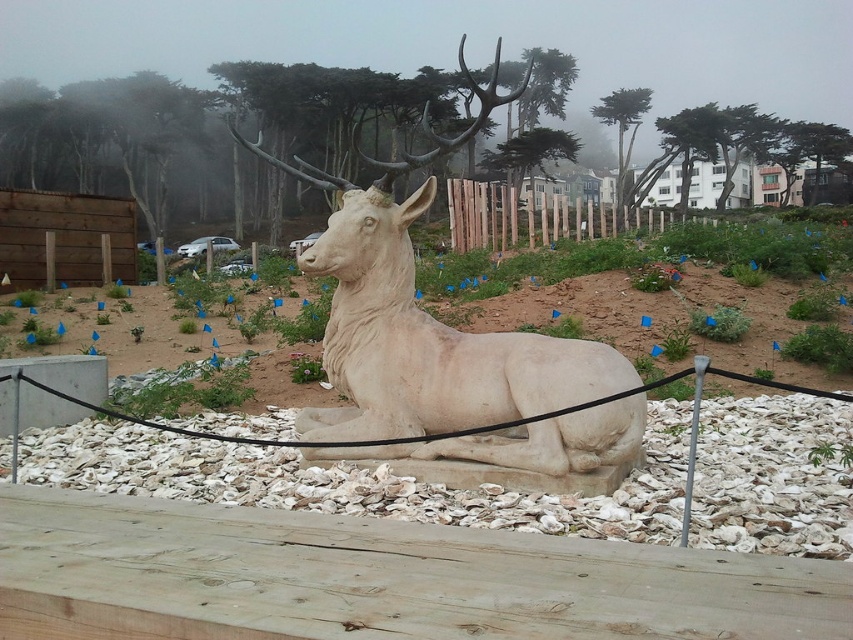
You are an artist planning to place a new sculpture in the outdoor setting. You want to ensure it aligns with the existing white stone sculpture at center. Where should you position your new sculpture relative to the white gravel at center to maintain alignment?

To maintain alignment with the existing white stone sculpture at center, you should position your new sculpture above the white gravel at center, as the white gravel at center is currently below the white stone sculpture at center.

In the scene shown: You are standing at the point with coordinates (354, 481) in the image. Based on the scene description, what material are you standing on?

The point at (354, 481) corresponds to white gravel at center, so you are standing on white gravel.

You are standing in the outdoor area and want to walk from the white gravel at center to the white stone sculpture at center. Which direction should you move to reach the sculpture?

You should move to the right from the white gravel at center to reach the white stone sculpture at center since the gravel is located to its left.